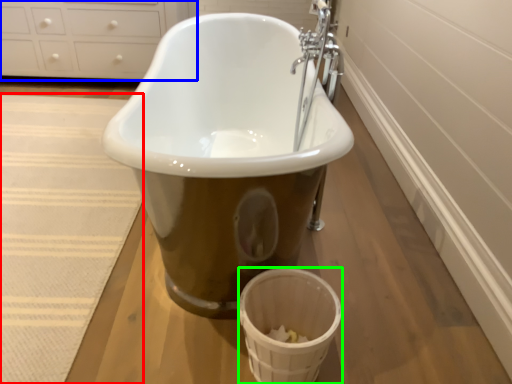
Question: Based on their relative distances, which object is nearer to bath mat (highlighted by a red box)? Choose from cabinetry (highlighted by a blue box) and basket (highlighted by a green box).

Choices:
 (A) cabinetry
 (B) basket

Answer: (B)